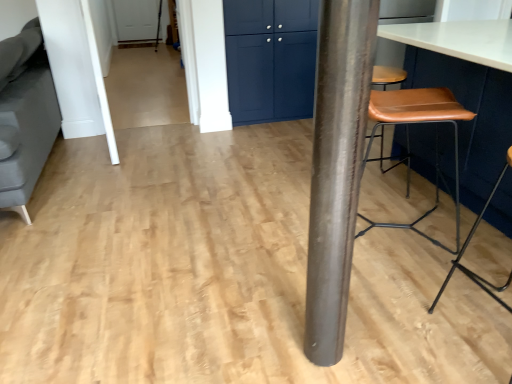
Question: In terms of size, does white smooth door at upper left appear bigger or smaller than matte blue cabinet at upper center?

Choices:
 (A) small
 (B) big

Answer: (B)

Question: Is point (90, 16) closer or farther from the camera than point (257, 92)?

Choices:
 (A) farther
 (B) closer

Answer: (B)

Question: Based on their relative distances, which object is farther from the brown leather stool at right?

Choices:
 (A) white smooth door at upper left
 (B) brown leather stool at right
 (C) shiny metallic pole at center
 (D) gray fabric swivel chair at left
 (E) matte blue cabinet at upper center

Answer: (D)

Question: Estimate the real-world distances between objects in this image. Which object is closer to the gray fabric swivel chair at left?

Choices:
 (A) matte blue cabinet at upper center
 (B) shiny metallic pole at center
 (C) brown leather stool at right
 (D) white smooth door at upper left
 (E) brown leather stool at right

Answer: (D)